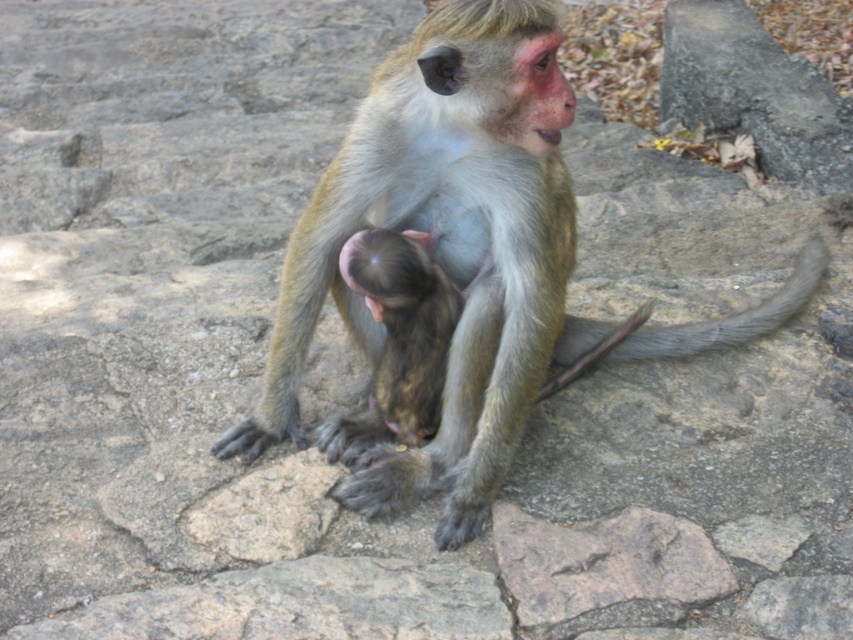
Question: Does green fur monkey at center lie behind soft fur monkey at center?

Choices:
 (A) yes
 (B) no

Answer: (B)

Question: Which of the following is the closest to the observer?

Choices:
 (A) soft fur monkey at center
 (B) green fur monkey at center

Answer: (B)

Question: Can you confirm if green fur monkey at center is positioned above soft fur monkey at center?

Choices:
 (A) yes
 (B) no

Answer: (A)

Question: Can you confirm if green fur monkey at center is positioned below soft fur monkey at center?

Choices:
 (A) yes
 (B) no

Answer: (B)

Question: Among these objects, which one is farthest from the camera?

Choices:
 (A) soft fur monkey at center
 (B) green fur monkey at center

Answer: (A)

Question: Among these objects, which one is farthest from the camera?

Choices:
 (A) soft fur monkey at center
 (B) green fur monkey at center

Answer: (A)